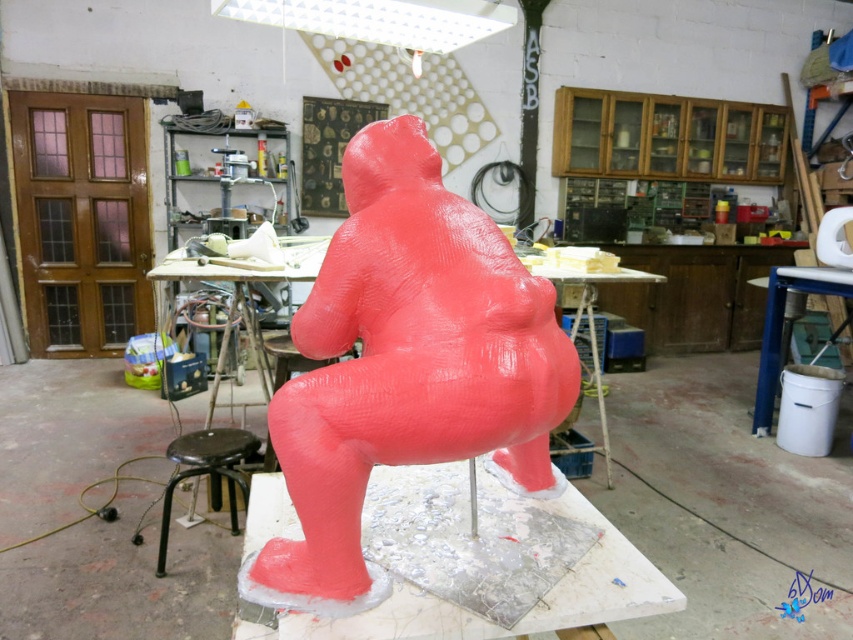
You are standing in the workshop and want to move from the point at coordinates (364,208) to the point at (173,442). According to the spatial arrangement, which direction should you move to reach your destination?

To move from point (364,208) to point (173,442), you should move backward since point (364,208) is in front of point (173,442).

You are an artist who needs to move the black metal stool at lower left closer to the matte pink sculpture at center. Considering their sizes, will the stool fit entirely under the sculpture without overlapping?

The matte pink sculpture at center is wider than the black metal stool at lower left. Since the sculpture is wider, the stool can fit entirely under it without overlapping as long as it is positioned properly.

You are an artist entering the workshop and need to access the black metal stool at lower left. The matte pink sculpture at center is in the way. Can you move the sculpture to reach the stool?

The matte pink sculpture at center is positioned over black metal stool at lower left, so you cannot reach the stool without moving the sculpture first.